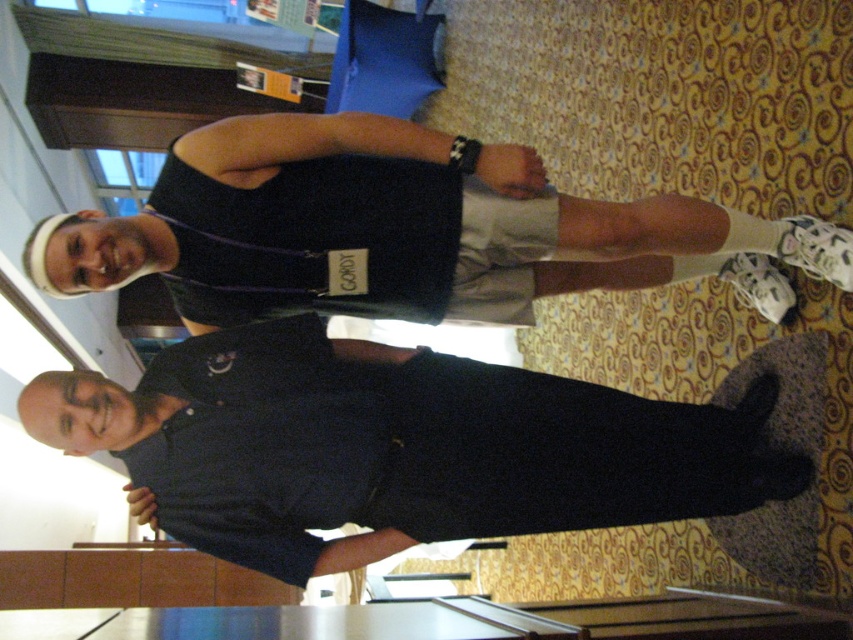
You are at an event and see the black smooth shirt at center and the black fabric tank top at upper center. Which one is closer to you?

The black smooth shirt at center is closer to you because it is in front of the black fabric tank top at upper center.

Based on the coordinates provided, which object corresponds to the point at (396, 448)?

The point at (396, 448) corresponds to the black smooth shirt at center.

You are organizing a clothing donation drive and need to categorize the black smooth shirt at center and the black fabric tank top at upper center based on their size. Which one should be placed in the large size bin?

The black smooth shirt at center is larger in size than the black fabric tank top at upper center, so it should be placed in the large size bin.